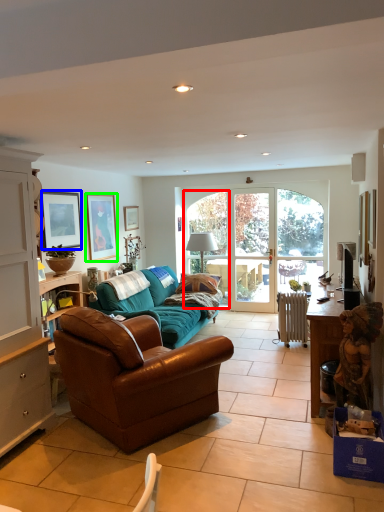
Question: Which is farther away from window (highlighted by a red box)? picture frame (highlighted by a blue box) or picture frame (highlighted by a green box)?

Choices:
 (A) picture frame
 (B) picture frame

Answer: (A)